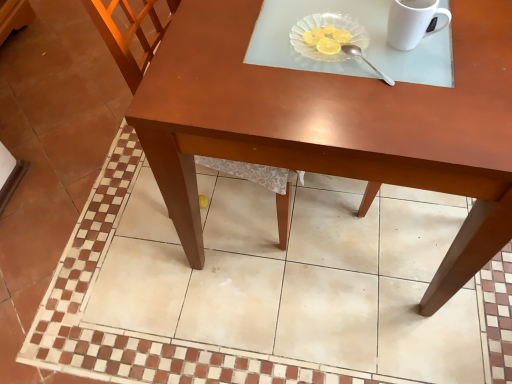
Image resolution: width=512 pixels, height=384 pixels. I want to click on vacant space to the left of white glossy mug at upper right, so click(x=320, y=48).